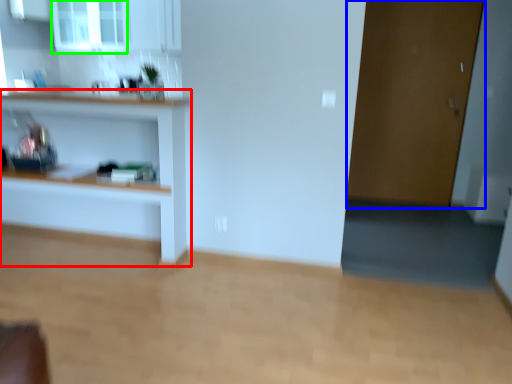
Question: Which is nearer to the shelf (highlighted by a red box)? door (highlighted by a blue box) or window (highlighted by a green box).

Choices:
 (A) door
 (B) window

Answer: (B)